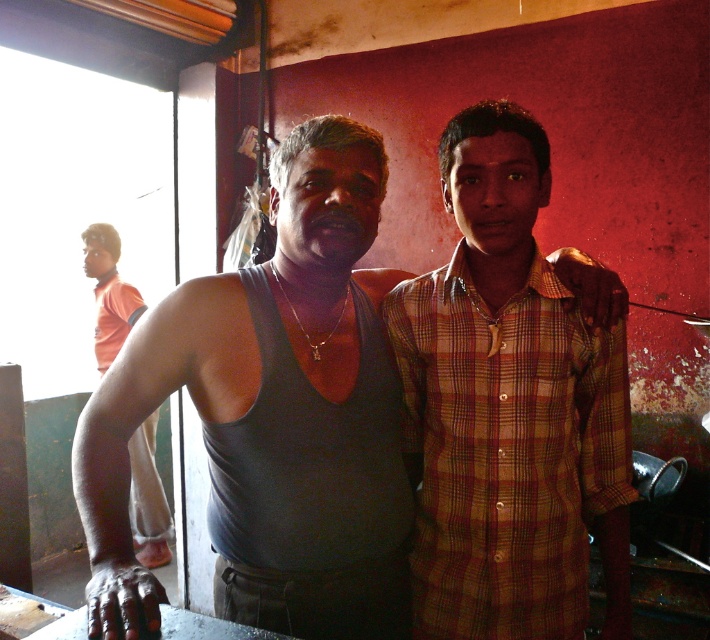
You are a photographer setting up a photo shoot. You have two outfits to choose from for the main character. The first is the plaid shirt at center and the second is the gray matte tank top at center. Which outfit would you recommend if you want the outfit to cover more of the character?

The plaid shirt at center is larger in size than the gray matte tank top at center, so the plaid shirt at center would cover more of the character.

You are trying to decide which clothing item to take for a photoshoot. The scene shows two people standing close. The dark gray tank top at center and the orange fabric shirt at left are visible. Based on their sizes, which one would you choose if you want something that looks bigger on camera?

The dark gray tank top at center has a larger size compared to the orange fabric shirt at left, so it would look bigger on camera.

You are a photographer trying to capture a closeup shot of both the plaid shirt at center and the gray matte tank top at center. Given that your camera can only focus on objects within a 5 inch range, will you be able to capture both in focus?

The plaid shirt at center and the gray matte tank top at center are 7.96 inches apart from each other. Since the camera can only focus within a 5 inch range, the distance between them exceeds this limit. Therefore, you cannot capture both in focus simultaneously.